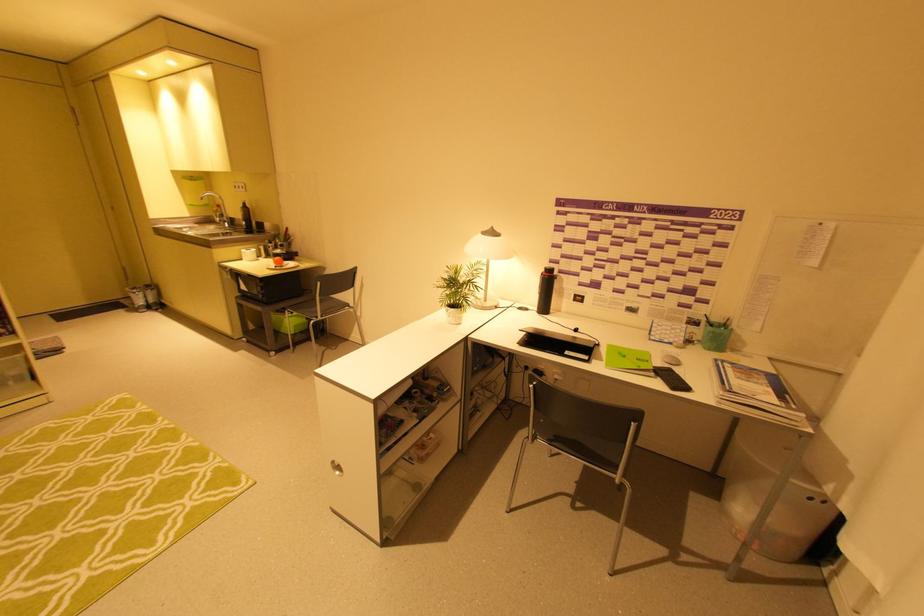
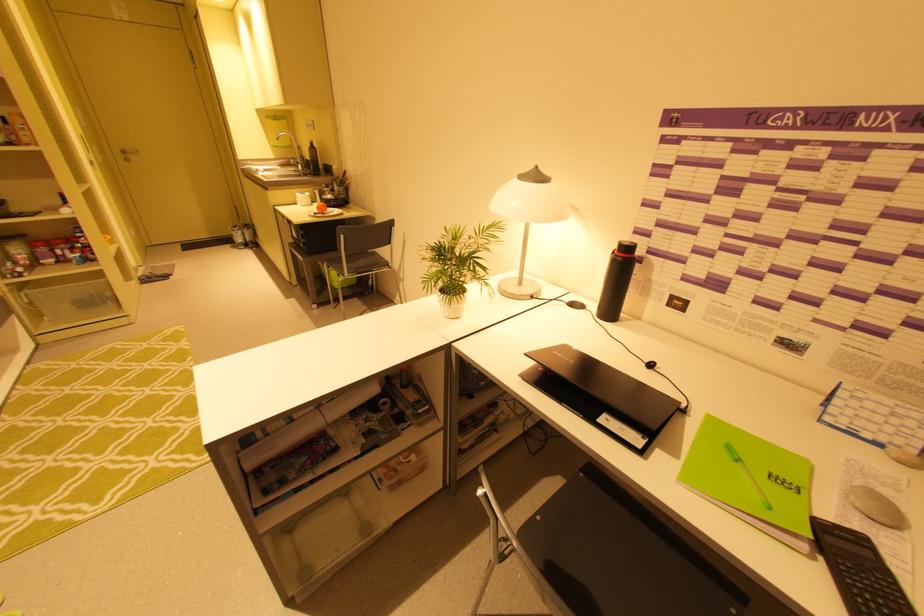
Question: The camera is either moving clockwise (left) or counter-clockwise (right) around the object. The first image is from the beginning of the video and the second image is from the end. Is the camera moving left or right when shooting the video?

Choices:
 (A) Left
 (B) Right

Answer: (B)